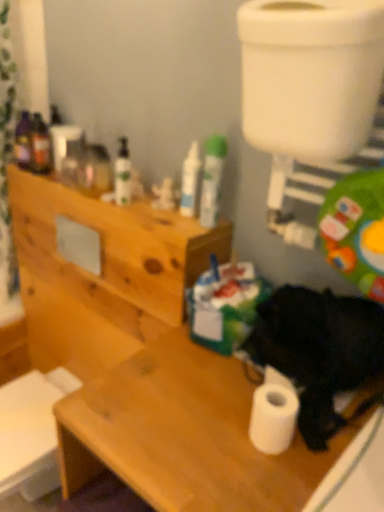
Locate an element on the screen. free space above wooden desk at lower right (from a real-world perspective) is located at coordinates (213, 406).